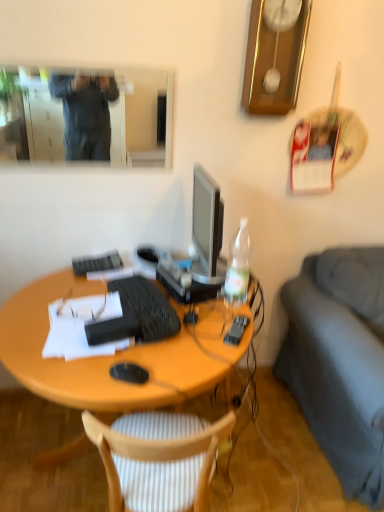
Locate an element on the screen. This screenshot has width=384, height=512. free spot to the left of black plastic remote control at right is located at coordinates (199, 332).